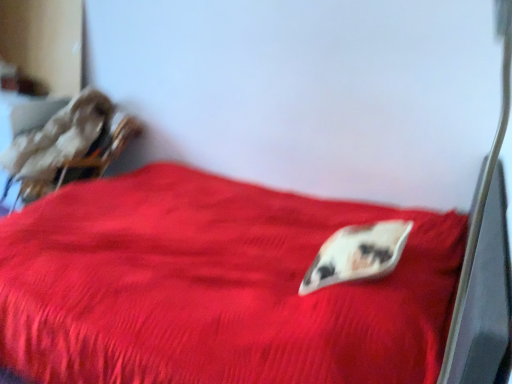
This screenshot has height=384, width=512. What are the coordinates of `velvet-like brown armchair at upper left` in the screenshot? It's located at (67, 147).

Measure the distance between velvet-like brown armchair at upper left and camera.

The distance of velvet-like brown armchair at upper left from camera is 8.12 feet.

Image resolution: width=512 pixels, height=384 pixels. What do you see at coordinates (67, 147) in the screenshot?
I see `velvet-like brown armchair at upper left` at bounding box center [67, 147].

The width and height of the screenshot is (512, 384). Identify the location of velvet-like brown armchair at upper left. (67, 147).